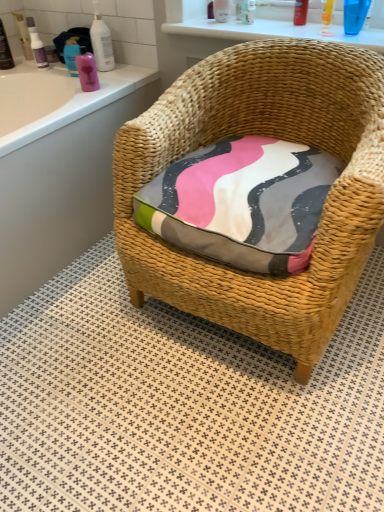
Image resolution: width=384 pixels, height=512 pixels. In order to click on vacant space in front of translucent plastic bottle at upper center, the ninth toiletry from the left in this screenshot , I will do `click(310, 28)`.